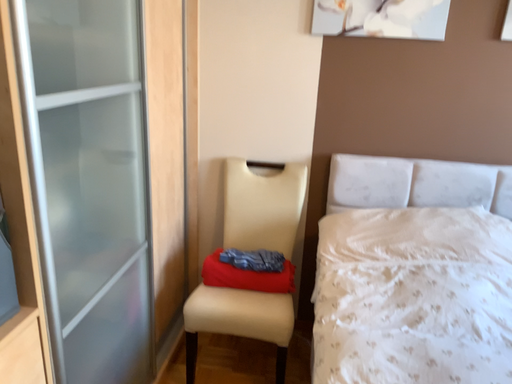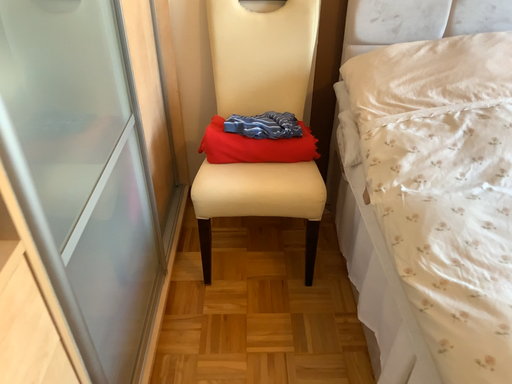
Question: How did the camera likely rotate when shooting the video?

Choices:
 (A) rotated upward
 (B) rotated downward

Answer: (B)